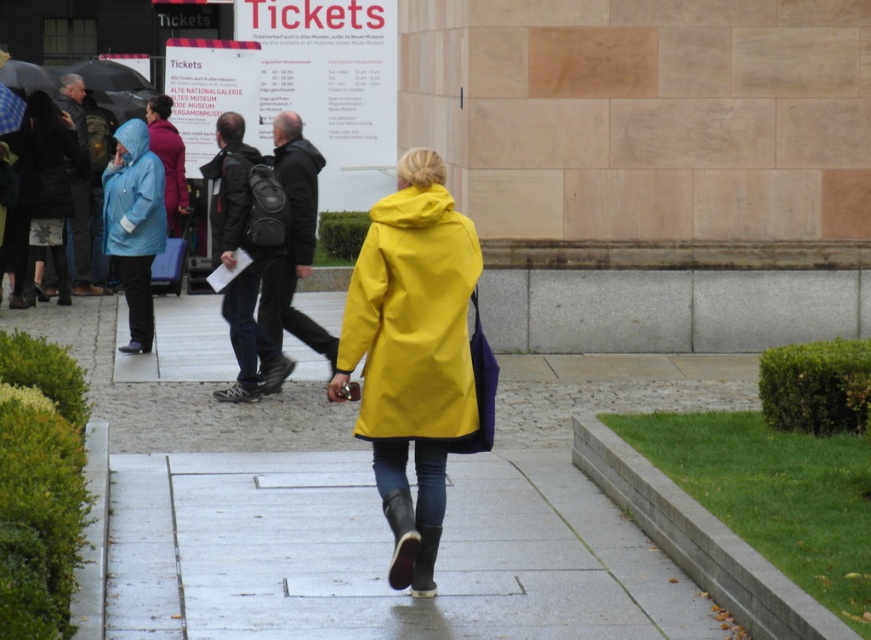
Question: Is yellow matte raincoat at center thinner than black matte umbrella at upper left?

Choices:
 (A) no
 (B) yes

Answer: (B)

Question: Which of the following is the closest to the observer?

Choices:
 (A) (154, 538)
 (B) (273, 161)
 (C) (83, 76)

Answer: (A)

Question: Which object is positioned farthest from the black matte umbrella at upper left?

Choices:
 (A) yellow matte raincoat at center
 (B) dark gray textured jacket at center

Answer: (A)

Question: Does matte black coat at center have a lesser width compared to black matte umbrella at upper left?

Choices:
 (A) yes
 (B) no

Answer: (A)

Question: Does smooth concrete pavement at center appear on the left side of dark gray textured jacket at center?

Choices:
 (A) no
 (B) yes

Answer: (A)

Question: Which point is farther to the camera?

Choices:
 (A) smooth concrete pavement at center
 (B) yellow matte raincoat at center
 (C) dark gray textured jacket at center
 (D) matte blue raincoat at left

Answer: (D)